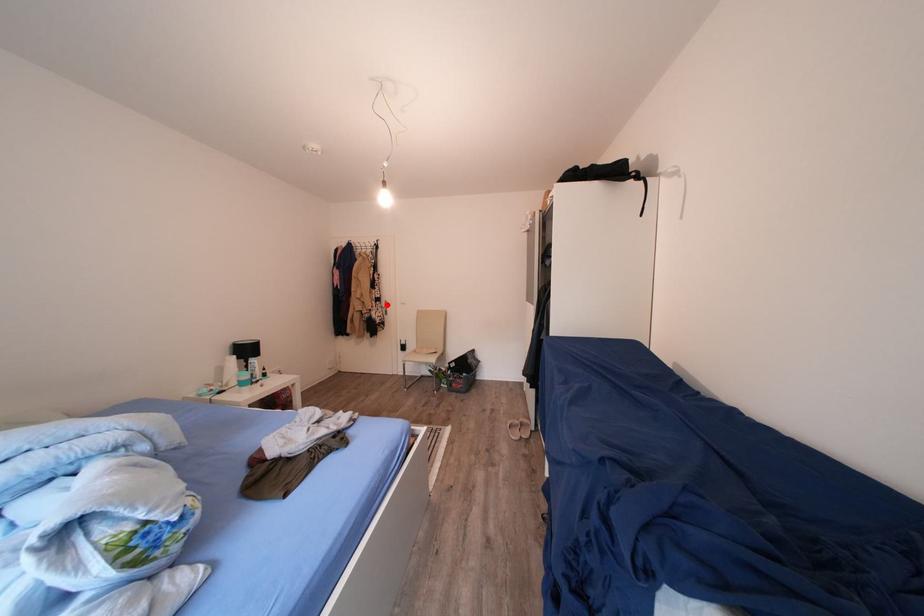
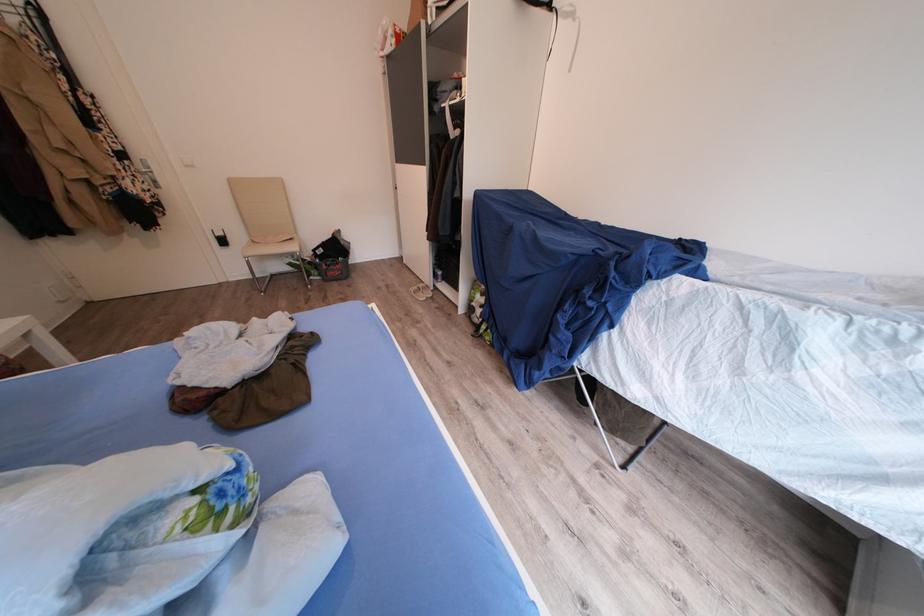
The point at the highlighted location is marked in the first image. Where is the corresponding point in the second image?

(130, 161)